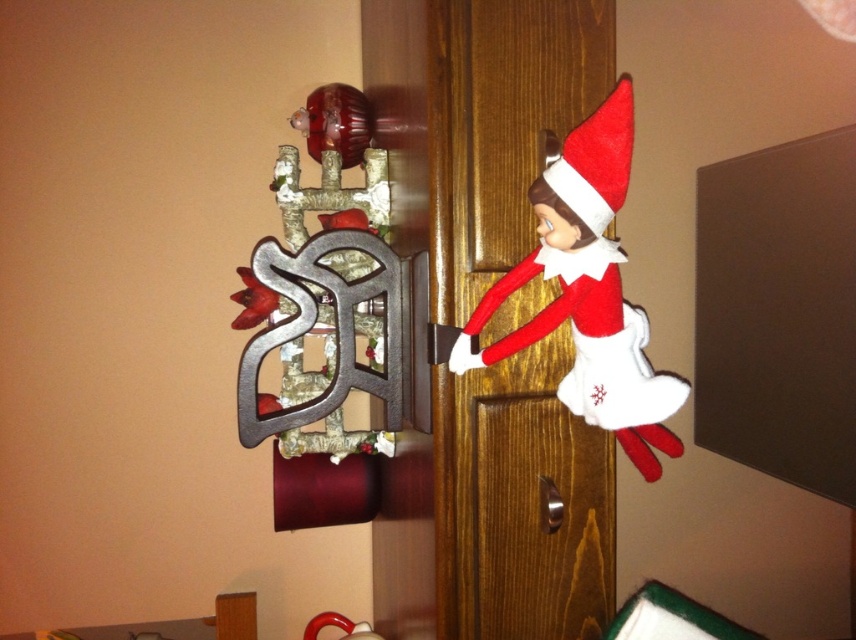
You are a delivery person trying to deliver a package. You see a wooden door at center and a polished silver door handle at center. Which object is wider?

The wooden door at center is wider than the polished silver door handle at center.